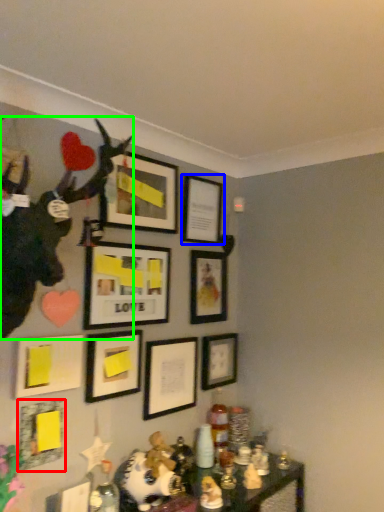
Question: Based on their relative distances, which object is nearer to picture frame (highlighted by a red box)? Choose from picture frame (highlighted by a blue box) and animal (highlighted by a green box).

Choices:
 (A) picture frame
 (B) animal

Answer: (B)